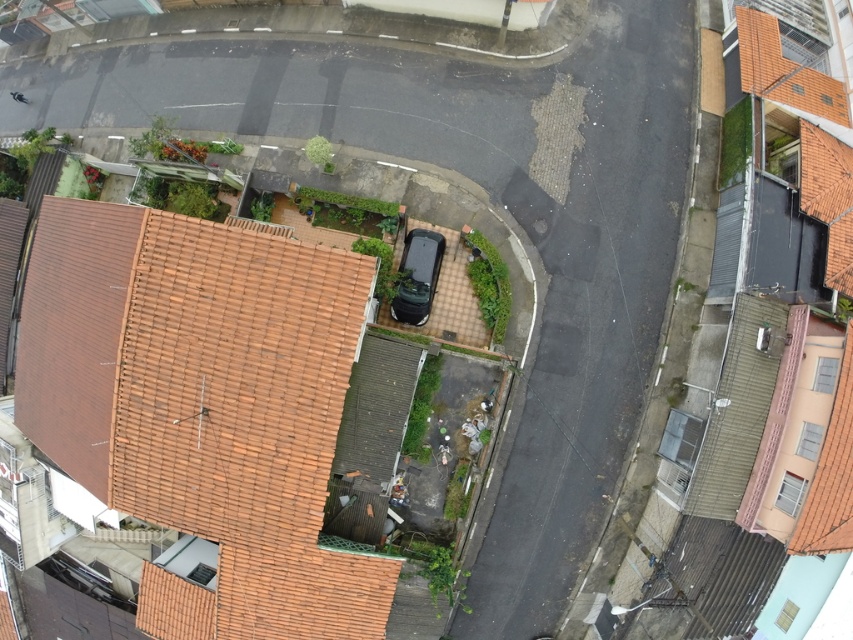
You are a city planner reviewing this aerial image of a residential area. You need to determine which of the two roofs, the brown tile roof at lower left or the orange tile roof at upper right, would be more suitable for installing a solar panel system based on their size. Which roof would you recommend?

The brown tile roof at lower left has a larger size compared to the orange tile roof at upper right, so it would be more suitable for installing a solar panel system due to its greater surface area.

You are a drone operator tasked with capturing aerial footage of the residential area. Your drone has a maximum flight range of 25 meters. You need to fly from the brown tile roof at lower left to the orange tile roof at upper right. Can your drone complete this flight without needing to return to its starting point?

The brown tile roof at lower left is 27.34 meters away from the orange tile roof at upper right. Since the drone has a maximum flight range of 25 meters, it cannot complete the flight without needing to return to its starting point.

You are a city planner analyzing the aerial view of this residential area. You need to determine which of the two roofs, the brown tile roof at lower left or the orange tile roof at upper right, has a greater width to accommodate more solar panels. Based on the image, which roof would you recommend?

The brown tile roof at lower left has a larger width than the orange tile roof at upper right, so it can accommodate more solar panels.